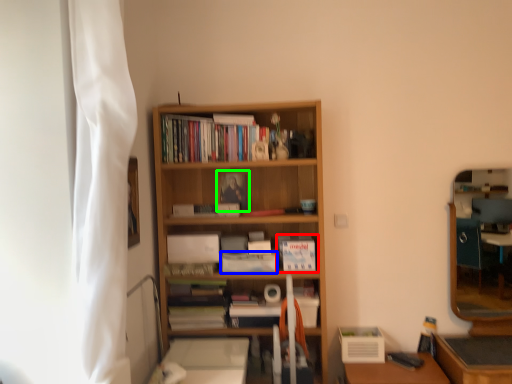
Question: Based on their relative distances, which object is farther from book (highlighted by a red box)? Choose from paperback book (highlighted by a blue box) and paperback book (highlighted by a green box).

Choices:
 (A) paperback book
 (B) paperback book

Answer: (B)